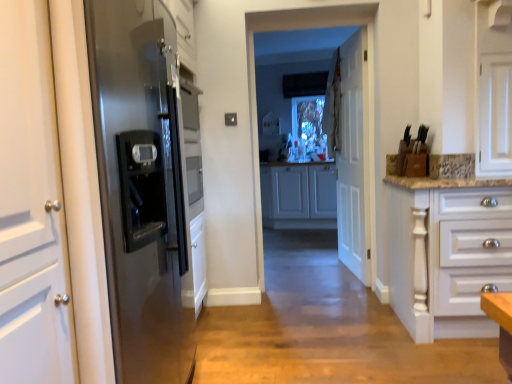
The width and height of the screenshot is (512, 384). What are the coordinates of `vacant space situated on the left part of clear glass window at center` in the screenshot? It's located at (284, 297).